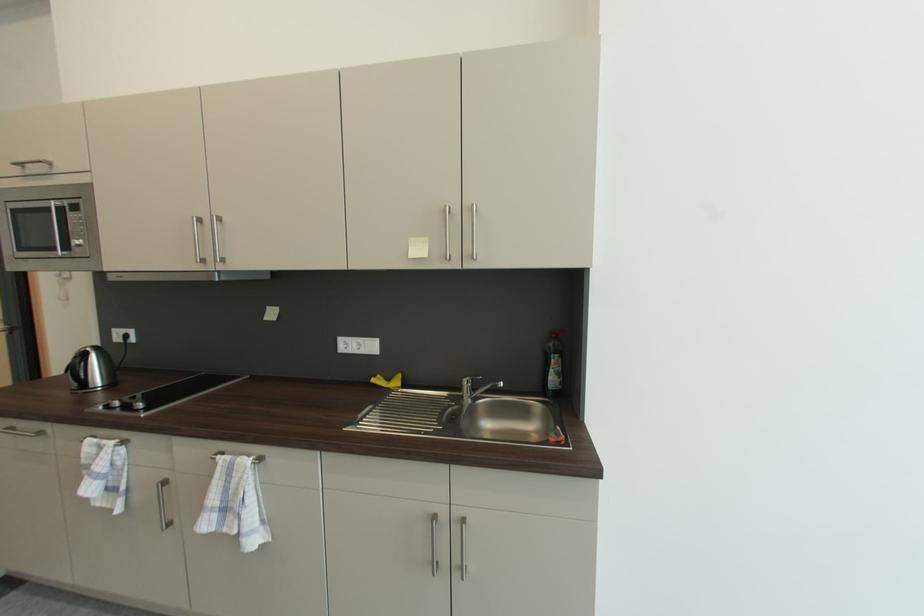
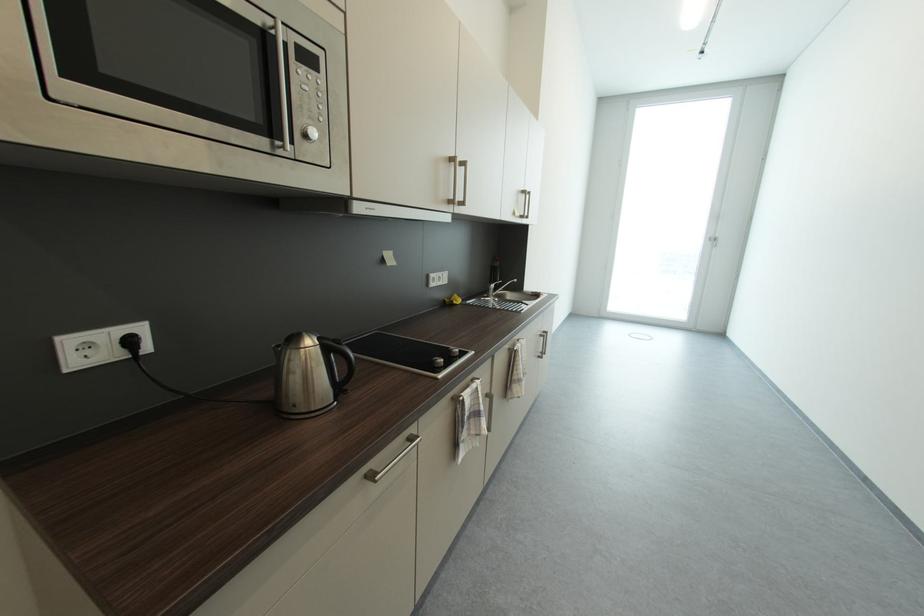
The point at (89, 463) is marked in the first image. Where is the corresponding point in the second image?

(472, 419)